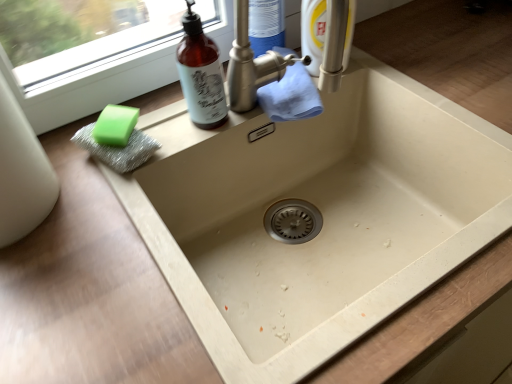
This screenshot has width=512, height=384. Identify the location of free space that is in between green sponge at left and brown glass bottle at upper left. (169, 129).